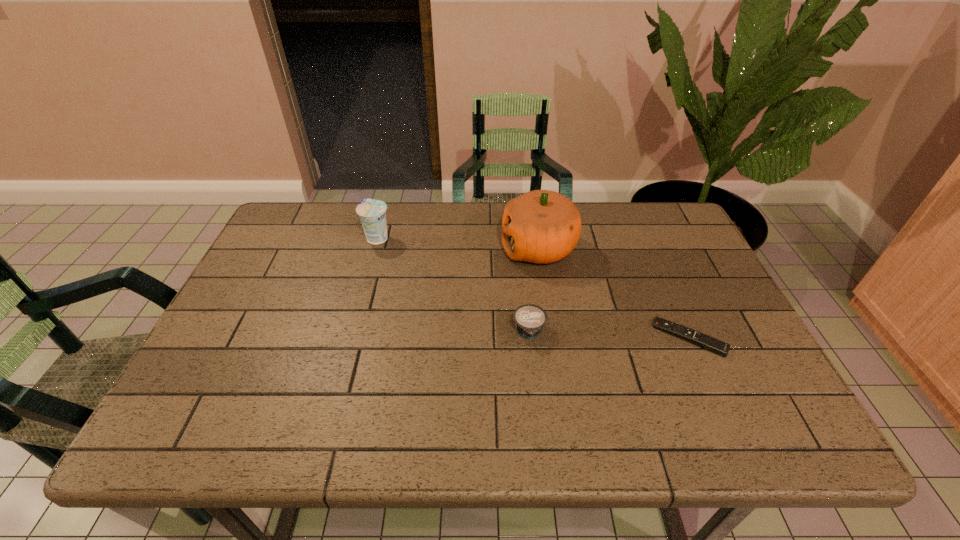
Identify the location of vacant space located 0.250m on the front of the taller yogurt. (358, 310).

This screenshot has height=540, width=960. Identify the location of free region located on the right of the shorter yogurt. pyautogui.click(x=703, y=332).

Where is `vacant point located on the back of the remote control`? This screenshot has height=540, width=960. vacant point located on the back of the remote control is located at coordinates (662, 278).

You are a GUI agent. You are given a task and a screenshot of the screen. Output one action in this format:
    pyautogui.click(x=<x>, y=<y>)
    Task: Click on the pumpkin present at the far edge
    
    Given the screenshot: What is the action you would take?
    pyautogui.click(x=541, y=226)

The height and width of the screenshot is (540, 960). What are the coordinates of `yogurt situated at the far edge` in the screenshot? It's located at (372, 213).

Locate an element on the screen. The image size is (960, 540). object that is positioned at the right edge is located at coordinates (707, 342).

The height and width of the screenshot is (540, 960). Find the location of `free space at the far edge of the desktop`. free space at the far edge of the desktop is located at coordinates (363, 246).

Locate an element on the screen. vacant space at the near edge is located at coordinates (696, 408).

You are a GUI agent. You are given a task and a screenshot of the screen. Output one action in this format:
    pyautogui.click(x=<x>, y=<y>)
    Task: Click on the vacant area at the left edge of the desktop
    The image size is (960, 540).
    Given the screenshot: What is the action you would take?
    pyautogui.click(x=252, y=338)

The image size is (960, 540). In the image, there is a desktop. Find the location of `free region at the right edge`. free region at the right edge is located at coordinates (682, 313).